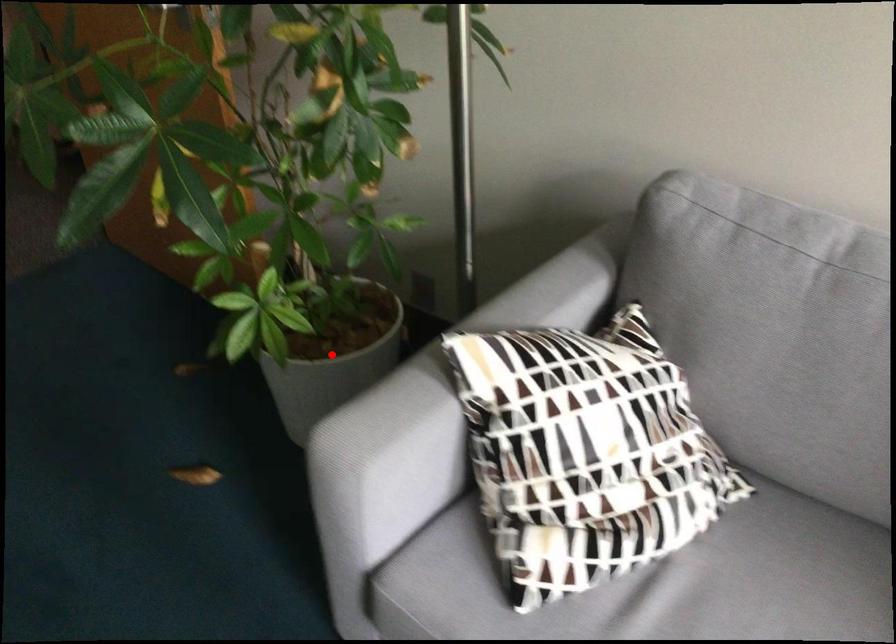
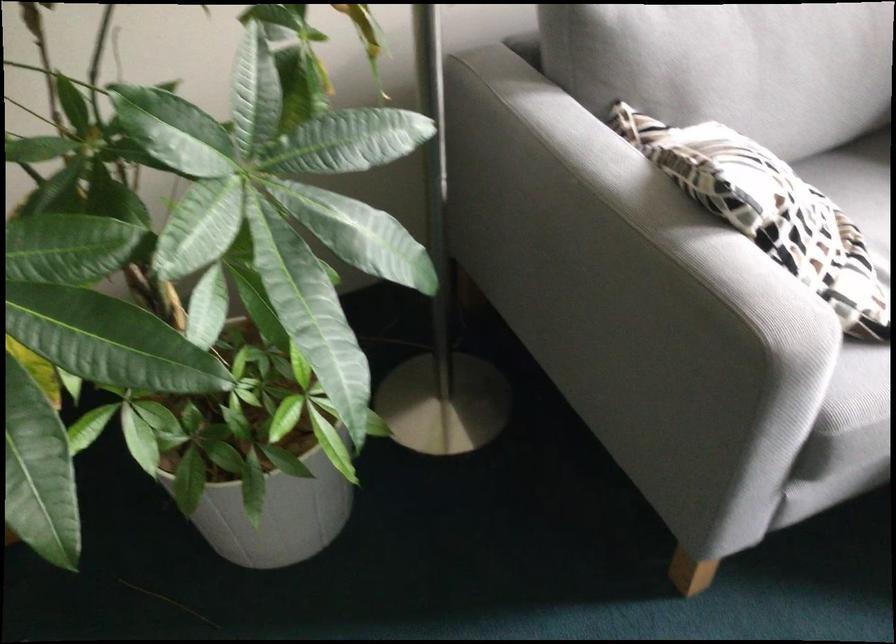
Question: I am providing you with two images of the same scene from different viewpoints. A red point is marked on the first image. Is the red point's position out of view in image 2?

Choices:
 (A) Yes
 (B) No

Answer: (A)